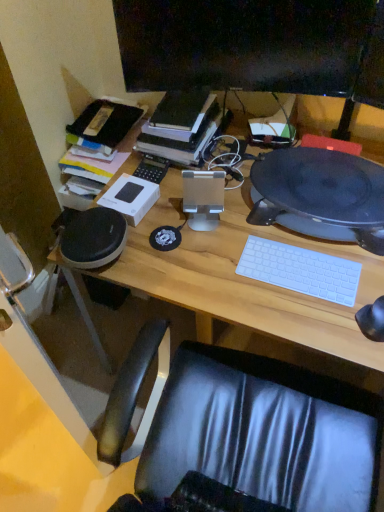
The height and width of the screenshot is (512, 384). Find the location of `vacant space underneath white matte keyboard at center (from a real-world perspective)`. vacant space underneath white matte keyboard at center (from a real-world perspective) is located at coordinates (294, 270).